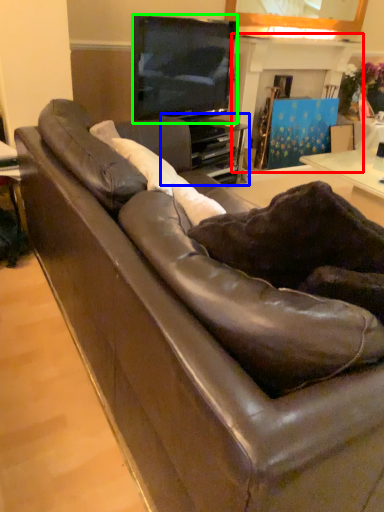
Question: Which object is positioned closest to fireplace (highlighted by a red box)? Select from entertainment center (highlighted by a blue box) and television (highlighted by a green box).

Choices:
 (A) entertainment center
 (B) television

Answer: (A)